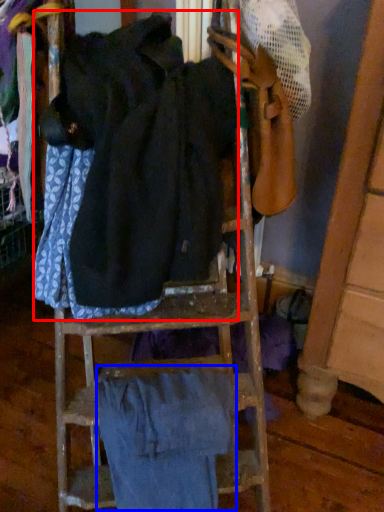
Question: Which of the following is the farthest to the observer, wide (highlighted by a red box) or wide (highlighted by a blue box)?

Choices:
 (A) wide
 (B) wide

Answer: (B)